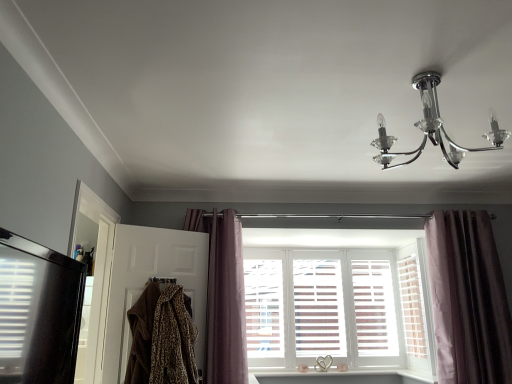
Locate an element on the screen. free spot above brown fur coat at left, which ranks as the 1th screen door in right-to-left order (from a real-world perspective) is located at coordinates (162, 230).